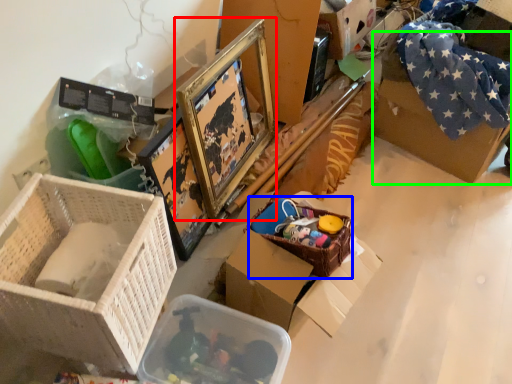
Question: Which object is positioned farthest from picture frame (highlighted by a red box)? Select from basket (highlighted by a blue box) and cardboard box (highlighted by a green box).

Choices:
 (A) basket
 (B) cardboard box

Answer: (B)